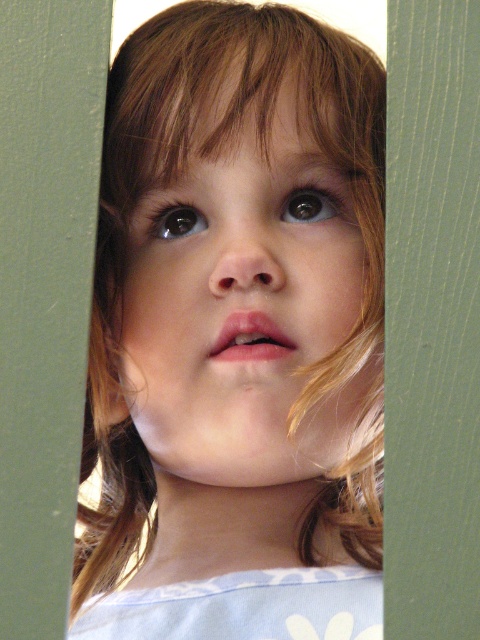
In the scene shown: In the portrait, you notice the smooth blonde hair at center and the green matte door at center. Which object takes up more space in the image?

The smooth blonde hair at center is larger in size than the green matte door at center, so it takes up more space in the image.

You are a photographer adjusting the focus on a camera. The camera has a focus point at point [367,618]. The subject is the child in the image. Is the focus point placed correctly to capture the child?

The focus point at point [367,618] is 20.02 inches away from the child, so it is not placed correctly to capture the child clearly.

You are an interior designer assessing a room layout. You notice the smooth blonde hair at center and the green matte door at center. Which object has a greater width according to the scene?

The smooth blonde hair at center has a greater width than the green matte door at center.